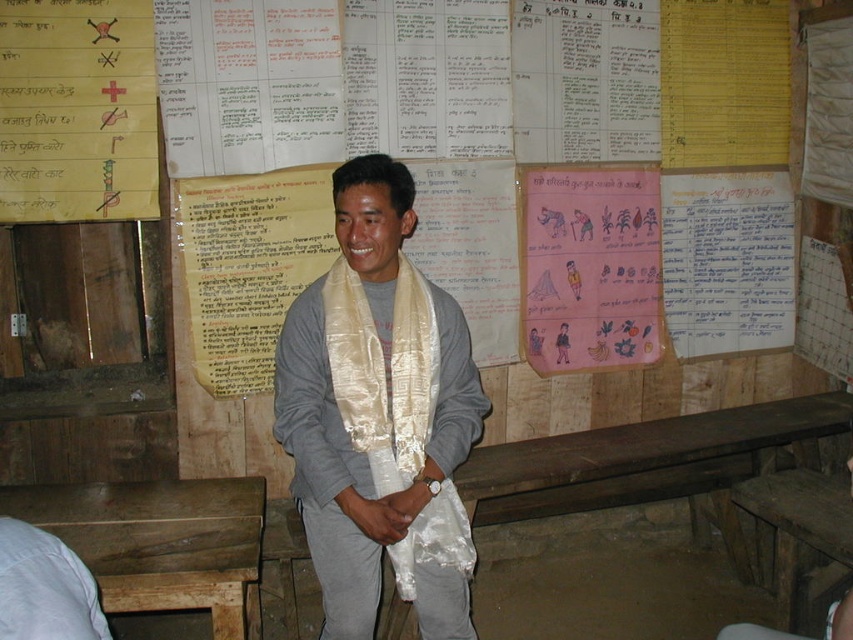
Measure the distance from blue paper at upper right to light gray fabric at lower left.

A distance of 8.23 feet exists between blue paper at upper right and light gray fabric at lower left.

Between blue paper at upper right and light gray fabric at lower left, which one has more height?

blue paper at upper right

Does point (704, 209) come in front of point (35, 577)?

That is False.

You are a GUI agent. You are given a task and a screenshot of the screen. Output one action in this format:
    pyautogui.click(x=<x>, y=<y>)
    Task: Click on the blue paper at upper right
    The height and width of the screenshot is (640, 853).
    Given the screenshot: What is the action you would take?
    pyautogui.click(x=727, y=259)

Can you confirm if pink paper poster at center is shorter than light gray fabric at lower left?

In fact, pink paper poster at center may be taller than light gray fabric at lower left.

What do you see at coordinates (589, 266) in the screenshot?
I see `pink paper poster at center` at bounding box center [589, 266].

This screenshot has height=640, width=853. Identify the location of pink paper poster at center. (589, 266).

Does pink paper poster at center appear on the right side of blue paper at upper right?

Incorrect, pink paper poster at center is not on the right side of blue paper at upper right.

This screenshot has width=853, height=640. What do you see at coordinates (589, 266) in the screenshot? I see `pink paper poster at center` at bounding box center [589, 266].

The height and width of the screenshot is (640, 853). Find the location of `pink paper poster at center`. pink paper poster at center is located at coordinates click(589, 266).